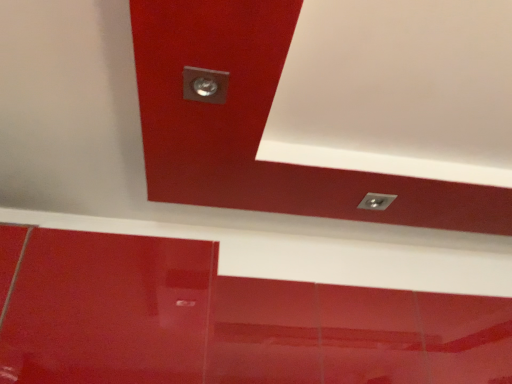
Question: From the image's perspective, is metallic silver exhaust hood at upper left located above metallic silver light fixture at upper right?

Choices:
 (A) yes
 (B) no

Answer: (A)

Question: Can you confirm if metallic silver exhaust hood at upper left is smaller than metallic silver light fixture at upper right?

Choices:
 (A) no
 (B) yes

Answer: (A)

Question: Can you confirm if metallic silver exhaust hood at upper left is positioned to the left of metallic silver light fixture at upper right?

Choices:
 (A) yes
 (B) no

Answer: (A)

Question: From the image's perspective, does metallic silver exhaust hood at upper left appear lower than metallic silver light fixture at upper right?

Choices:
 (A) yes
 (B) no

Answer: (B)

Question: Considering the relative sizes of metallic silver exhaust hood at upper left and metallic silver light fixture at upper right in the image provided, is metallic silver exhaust hood at upper left wider than metallic silver light fixture at upper right?

Choices:
 (A) no
 (B) yes

Answer: (B)

Question: Can you confirm if metallic silver exhaust hood at upper left is bigger than metallic silver light fixture at upper right?

Choices:
 (A) no
 (B) yes

Answer: (B)

Question: Is the surface of metallic silver light fixture at upper right in direct contact with metallic silver exhaust hood at upper left?

Choices:
 (A) no
 (B) yes

Answer: (A)

Question: Does metallic silver light fixture at upper right have a lesser width compared to metallic silver exhaust hood at upper left?

Choices:
 (A) yes
 (B) no

Answer: (A)

Question: Considering the relative sizes of metallic silver light fixture at upper right and metallic silver exhaust hood at upper left in the image provided, is metallic silver light fixture at upper right wider than metallic silver exhaust hood at upper left?

Choices:
 (A) no
 (B) yes

Answer: (A)

Question: From the image's perspective, would you say metallic silver light fixture at upper right is shown under metallic silver exhaust hood at upper left?

Choices:
 (A) no
 (B) yes

Answer: (B)

Question: Is metallic silver light fixture at upper right at the left side of metallic silver exhaust hood at upper left?

Choices:
 (A) no
 (B) yes

Answer: (A)

Question: From a real-world perspective, is metallic silver light fixture at upper right beneath metallic silver exhaust hood at upper left?

Choices:
 (A) yes
 (B) no

Answer: (A)

Question: Which is correct: metallic silver light fixture at upper right is inside metallic silver exhaust hood at upper left, or outside of it?

Choices:
 (A) outside
 (B) inside

Answer: (B)